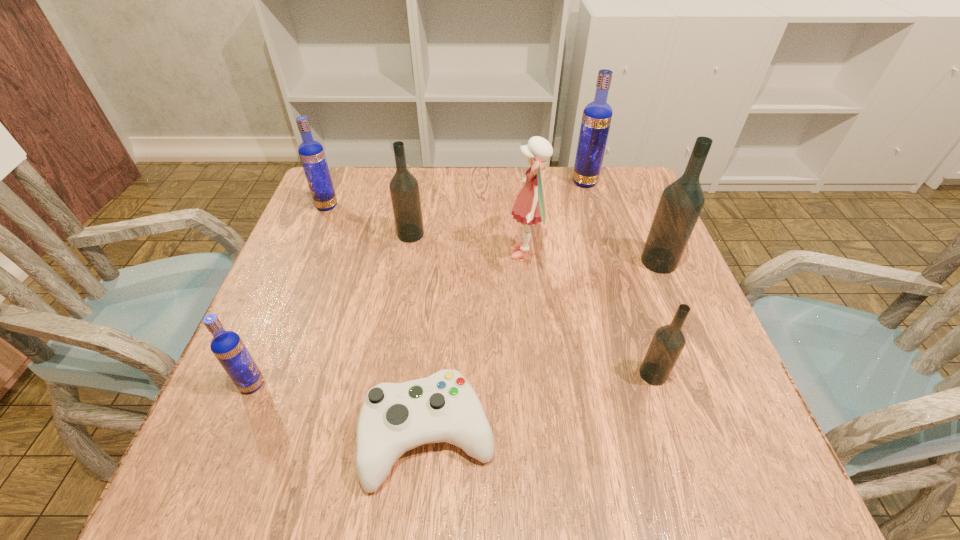
This screenshot has height=540, width=960. What are the coordinates of `free space at the right edge of the desktop` in the screenshot? It's located at [697, 417].

The height and width of the screenshot is (540, 960). In the image, there is a desktop. Identify the location of free space at the far left corner. (373, 169).

Locate an element on the screen. Image resolution: width=960 pixels, height=540 pixels. free space at the near left corner is located at coordinates (217, 443).

Locate an element on the screen. The width and height of the screenshot is (960, 540). vacant area at the far right corner of the desktop is located at coordinates (631, 168).

In order to click on vacant space that's between the rightmost vodka and the control in this screenshot , I will do `click(543, 349)`.

The height and width of the screenshot is (540, 960). Identify the location of vacant point located between the seventh nearest object and the control. (377, 321).

The height and width of the screenshot is (540, 960). I want to click on free space between the rightmost black vodka and the second biggest blue vodka, so click(x=492, y=234).

What are the coordinates of `free area in between the farthest blue vodka and the pink doll` in the screenshot? It's located at (555, 218).

Locate an element on the screen. This screenshot has width=960, height=540. empty space that is in between the smallest blue vodka and the second farthest blue vodka is located at coordinates (290, 295).

Find the location of a particular element. free area in between the nearest blue vodka and the farthest black vodka is located at coordinates (331, 309).